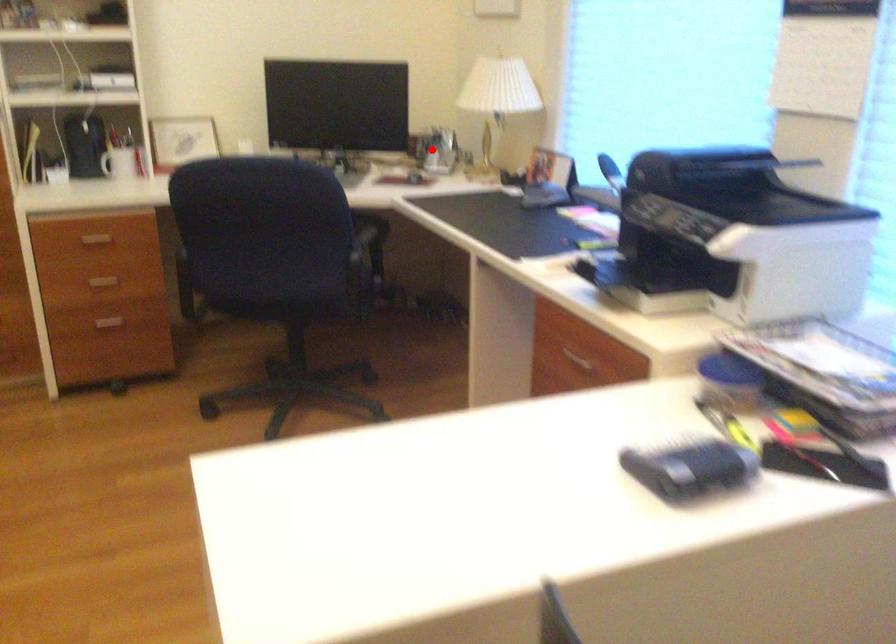
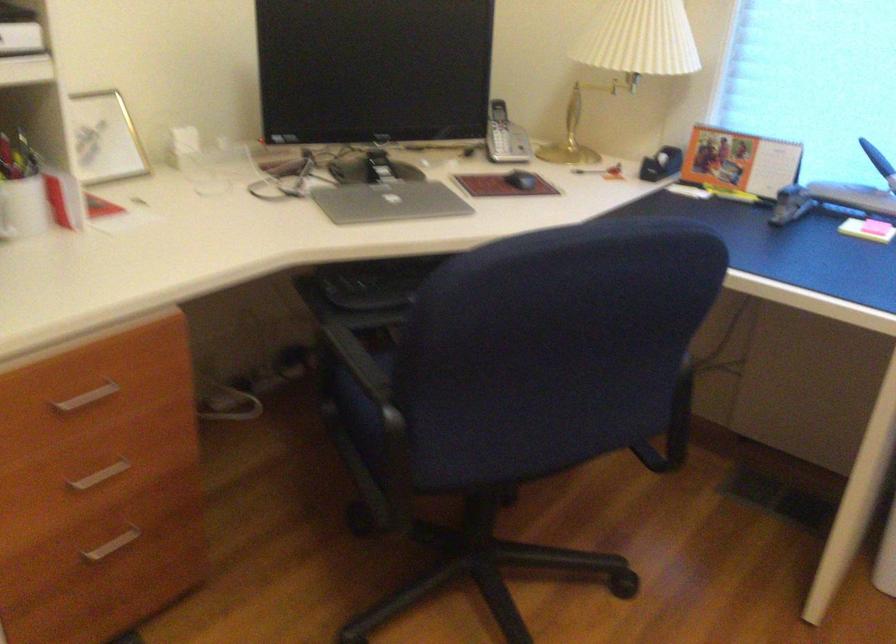
The point at the highlighted location is marked in the first image. Where is the corresponding point in the second image?

(504, 136)